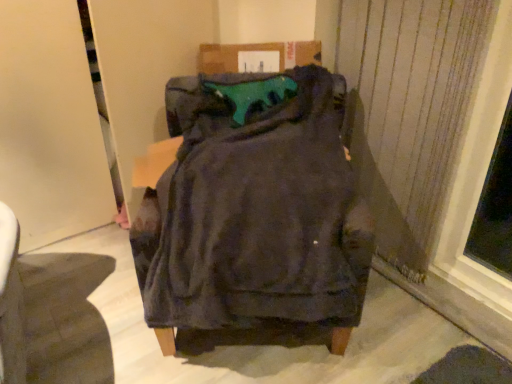
Question: Considering the positions of dark fabric chair at center and teal fabric cushion at center in the image, is dark fabric chair at center wider or thinner than teal fabric cushion at center?

Choices:
 (A) thin
 (B) wide

Answer: (B)

Question: Would you say dark fabric chair at center is to the left or to the right of teal fabric cushion at center in the picture?

Choices:
 (A) right
 (B) left

Answer: (B)

Question: Which is nearer to the dark fabric chair at center?

Choices:
 (A) teal fabric cushion at center
 (B) satin fabric curtain at right

Answer: (A)

Question: Which object is positioned closest to the teal fabric cushion at center?

Choices:
 (A) dark fabric chair at center
 (B) satin fabric curtain at right

Answer: (A)